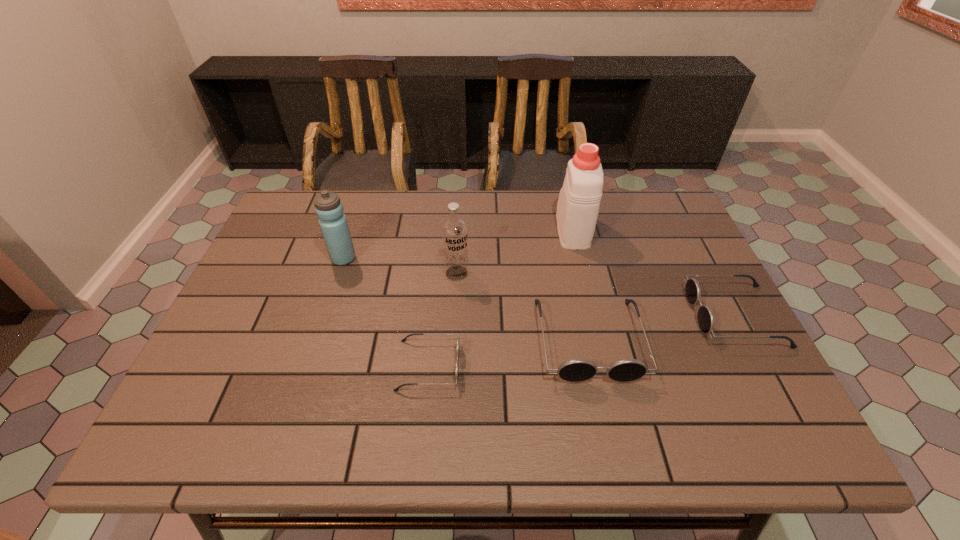
Locate an element on the screen. The height and width of the screenshot is (540, 960). free space at the left edge is located at coordinates click(x=289, y=308).

The image size is (960, 540). Find the location of `vacant area at the right edge of the desktop`. vacant area at the right edge of the desktop is located at coordinates (708, 297).

The image size is (960, 540). In the image, there is a desktop. Find the location of `free space at the near left corner`. free space at the near left corner is located at coordinates (260, 381).

At what (x,y) coordinates should I click in order to perform the action: click on vacant space that is in between the water bottle and the vodka. Please return your answer as a coordinate pair (x, y). This screenshot has width=960, height=540. Looking at the image, I should click on (400, 266).

You are a GUI agent. You are given a task and a screenshot of the screen. Output one action in this format:
    pyautogui.click(x=<x>, y=<y>)
    Task: Click on the vacant space that's between the second tallest sunglasses and the farthest object
    
    Given the screenshot: What is the action you would take?
    pyautogui.click(x=653, y=273)

Where is `vacant area that lies between the second sunglasses from left to right and the vodka`? vacant area that lies between the second sunglasses from left to right and the vodka is located at coordinates (523, 306).

The width and height of the screenshot is (960, 540). Find the location of `empty space that is in between the vodka and the shortest object`. empty space that is in between the vodka and the shortest object is located at coordinates (443, 319).

You are a GUI agent. You are given a task and a screenshot of the screen. Output one action in this format:
    pyautogui.click(x=<x>, y=<y>)
    Task: Click on the empty space between the vodka and the fifth tallest object
    This screenshot has width=960, height=540.
    Given the screenshot: What is the action you would take?
    pyautogui.click(x=595, y=294)

Where is `vacant space that is in between the vodka and the shortest sunglasses`? This screenshot has height=540, width=960. vacant space that is in between the vodka and the shortest sunglasses is located at coordinates (443, 319).

The width and height of the screenshot is (960, 540). I want to click on free space between the fifth tallest object and the leftmost object, so click(x=539, y=287).